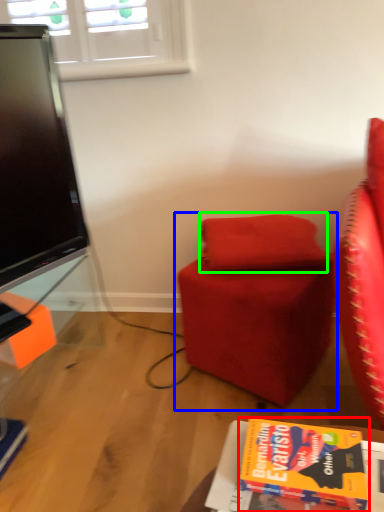
Question: Considering the real-world distances, which object is closest to book (highlighted by a red box)? chair (highlighted by a blue box) or pillow (highlighted by a green box).

Choices:
 (A) chair
 (B) pillow

Answer: (A)